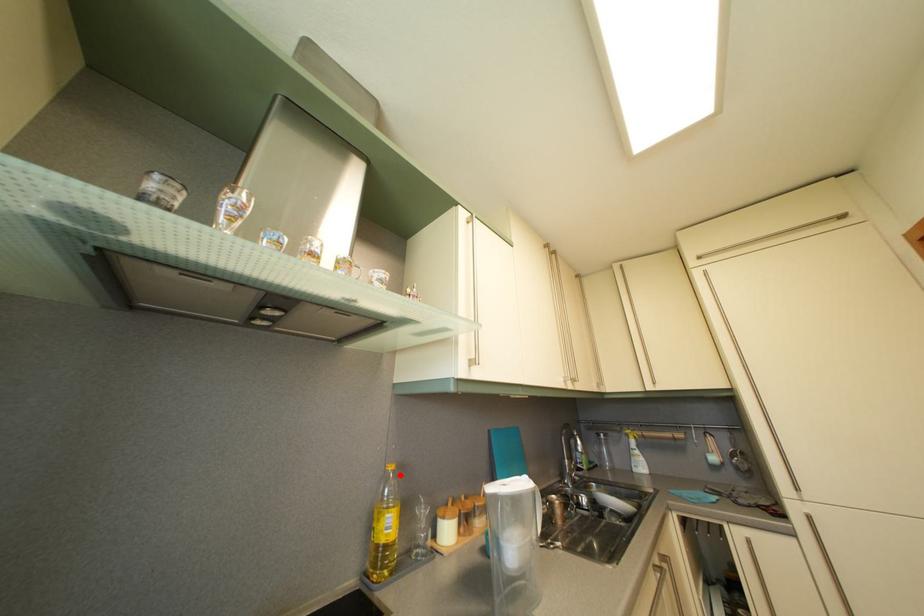
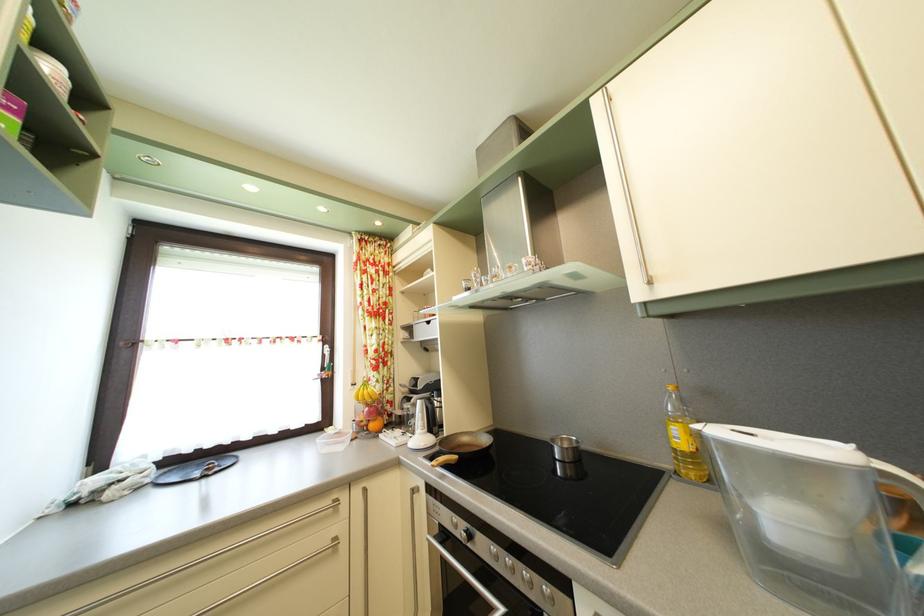
The point at the highlighted location is marked in the first image. Where is the corresponding point in the second image?

(678, 395)